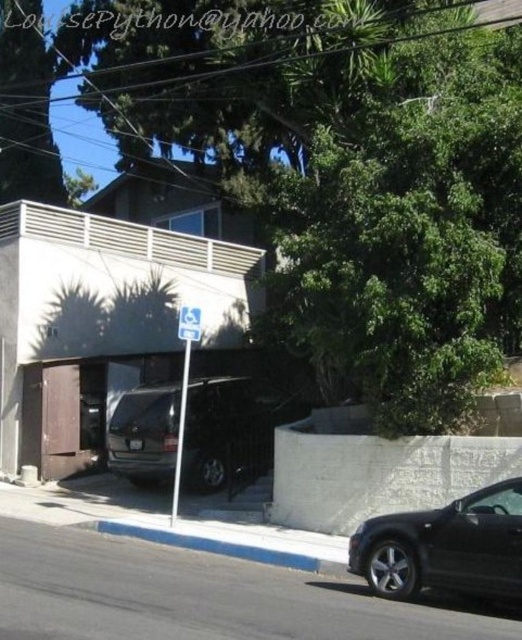
Is matte gray suv at center below blue plastic sign at center?

Indeed, matte gray suv at center is positioned under blue plastic sign at center.

Based on the photo, can you confirm if matte gray suv at center is positioned above blue plastic sign at center?

Incorrect, matte gray suv at center is not positioned above blue plastic sign at center.

In order to click on matte gray suv at center in this screenshot , I will do `click(230, 433)`.

You are a GUI agent. You are given a task and a screenshot of the screen. Output one action in this format:
    pyautogui.click(x=<x>, y=<y>)
    Task: Click on the matte gray suv at center
    The image size is (522, 640).
    Given the screenshot: What is the action you would take?
    pyautogui.click(x=230, y=433)

Between matte gray suv at center and black matte car at lower right, which one has more height?

matte gray suv at center is taller.

Image resolution: width=522 pixels, height=640 pixels. Describe the element at coordinates (230, 433) in the screenshot. I see `matte gray suv at center` at that location.

Locate an element on the screen. This screenshot has width=522, height=640. matte gray suv at center is located at coordinates (230, 433).

Which is more to the right, matte gray suv at center or blue plastic handicap sign at center?

From the viewer's perspective, matte gray suv at center appears more on the right side.

Where is `matte gray suv at center`? The height and width of the screenshot is (640, 522). matte gray suv at center is located at coordinates (230, 433).

Which is in front, point (255, 432) or point (197, 333)?

Point (197, 333) is more forward.

I want to click on matte gray suv at center, so click(230, 433).